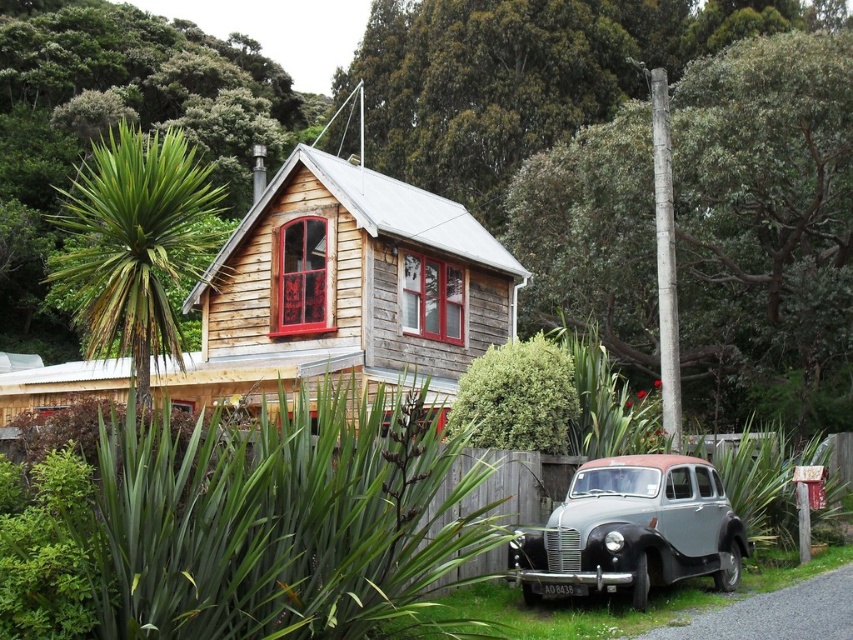
You are standing in front of the rustic wooden house and want to walk from the green leafy plant at center to the gray metallic car at lower right. Which direction should you move to get closer to the car?

Since the green leafy plant at center is closer to the viewer than the gray metallic car at lower right, you should move backward away from the house to reach the car.

You are standing in front of the rustic wooden house and notice a point marked at coordinates [277,518]. What does this point indicate?

The point at coordinates [277,518] marks the location of the green leafy plant at center.